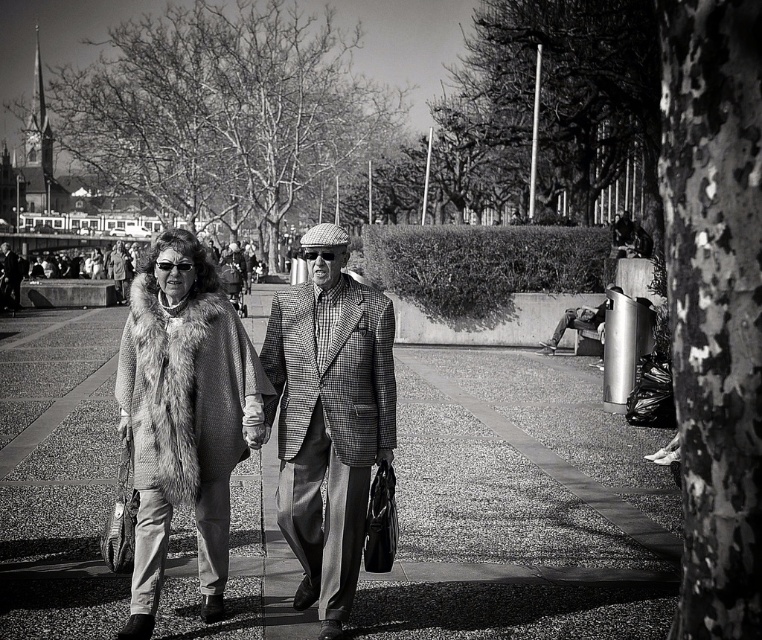
Question: Which point is farther to the camera?

Choices:
 (A) (110, 596)
 (B) (312, 314)
 (C) (135, 472)

Answer: (A)

Question: Which object appears closest to the camera in this image?

Choices:
 (A) smooth concrete pavement at center
 (B) houndstooth fabric jacket at center
 (C) fuzzy fur coat at center

Answer: (C)

Question: In this image, where is smooth concrete pavement at center located relative to houndstooth fabric jacket at center?

Choices:
 (A) left
 (B) right

Answer: (A)

Question: Can you confirm if smooth concrete pavement at center is positioned above houndstooth fabric jacket at center?

Choices:
 (A) no
 (B) yes

Answer: (A)

Question: Does smooth concrete pavement at center come in front of houndstooth fabric jacket at center?

Choices:
 (A) no
 (B) yes

Answer: (B)

Question: Considering the real-world distances, which object is closest to the smooth concrete pavement at center?

Choices:
 (A) fuzzy fur coat at center
 (B) houndstooth fabric jacket at center

Answer: (A)